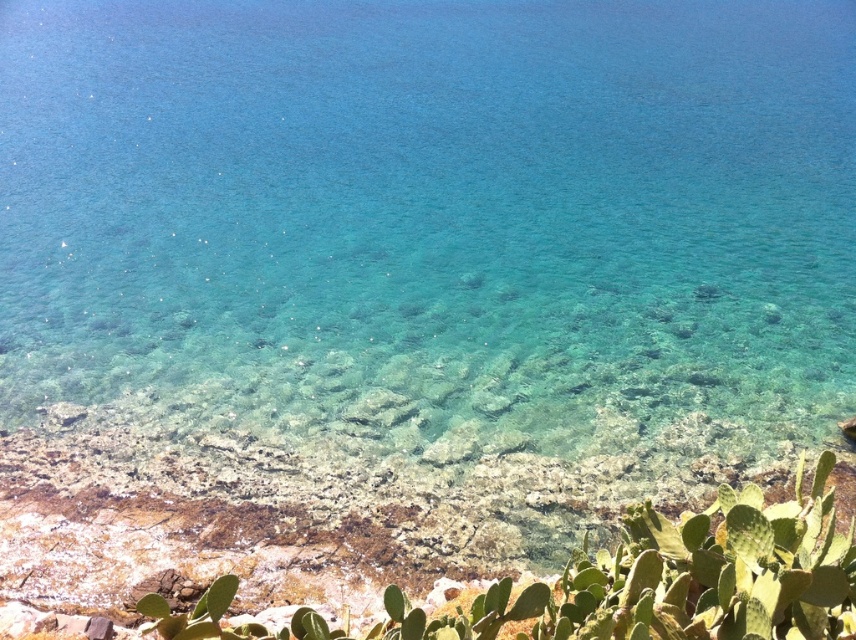
Which is behind, point (214, 140) or point (175, 628)?

Positioned behind is point (214, 140).

Is clear water at center positioned in front of green succulent at lower right?

No, clear water at center is further to the viewer.

Between point (336, 134) and point (194, 616), which one is positioned in front?

Point (194, 616) is in front.

You are a GUI agent. You are given a task and a screenshot of the screen. Output one action in this format:
    pyautogui.click(x=<x>, y=<y>)
    Task: Click on the clear water at center
    The image size is (856, 640).
    Given the screenshot: What is the action you would take?
    pyautogui.click(x=431, y=221)